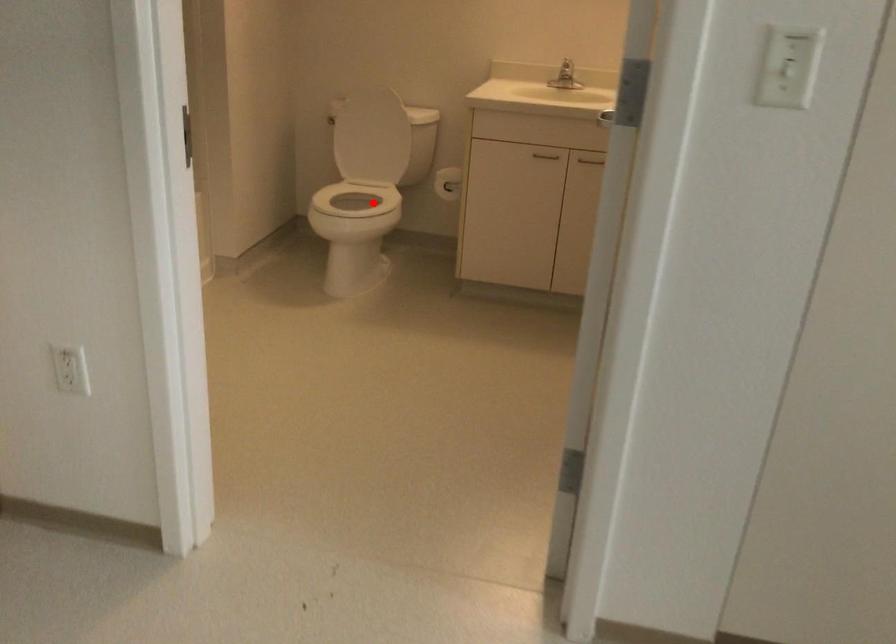
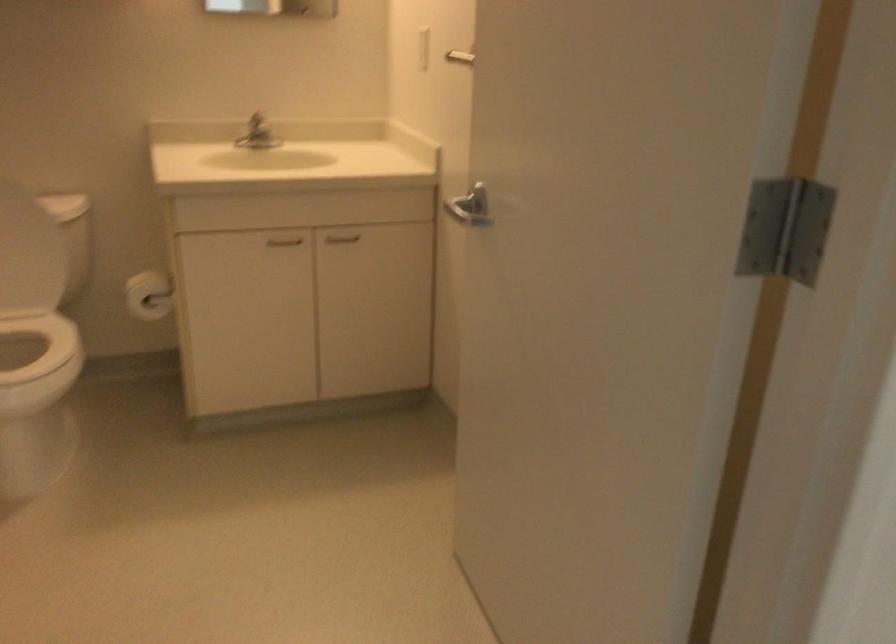
Where in the second image is the point corresponding to the highlighted location from the first image?

(22, 341)